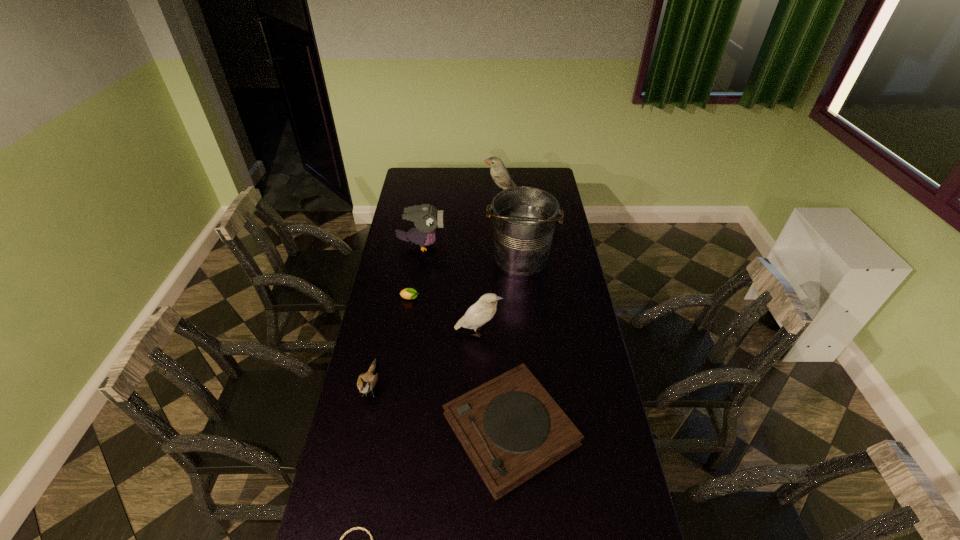
Where is `phonograph record that is at the right edge`? phonograph record that is at the right edge is located at coordinates (511, 428).

This screenshot has width=960, height=540. Find the location of `vacant area at the far edge`. vacant area at the far edge is located at coordinates (489, 177).

Find the location of a particular element. The image size is (960, 540). free region at the left edge is located at coordinates (405, 260).

This screenshot has height=540, width=960. In order to click on free point at the right edge in this screenshot , I will do `click(631, 534)`.

Locate an element on the screen. The height and width of the screenshot is (540, 960). free region at the far left corner of the desktop is located at coordinates (423, 186).

Locate an element on the screen. The image size is (960, 540). free space that is in between the bucket and the phonograph record is located at coordinates (516, 344).

Where is `empty space that is in between the third farthest bird and the second farthest bird`? This screenshot has height=540, width=960. empty space that is in between the third farthest bird and the second farthest bird is located at coordinates (450, 289).

The height and width of the screenshot is (540, 960). Identify the location of empty location between the seventh tallest object and the sixth tallest object. click(x=460, y=364).

At what (x,y) coordinates should I click in order to perform the action: click on vacant region between the lemon and the tallest object. Please return your answer as a coordinate pair (x, y). The image size is (960, 540). Looking at the image, I should click on (466, 279).

In order to click on vacant space in between the second farthest bird and the sixth tallest object in this screenshot , I will do `click(466, 338)`.